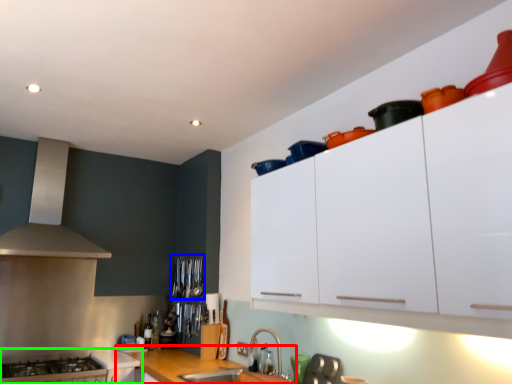
Question: Which object is the farthest from countertop (highlighted by a red box)? Choose among these: appliance (highlighted by a blue box) or cabinetry (highlighted by a green box).

Choices:
 (A) appliance
 (B) cabinetry

Answer: (A)